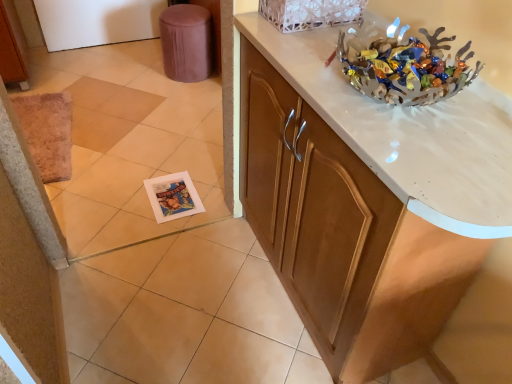
Locate an element on the screen. This screenshot has height=384, width=512. free location to the left of brown fabric stool at upper left is located at coordinates (141, 74).